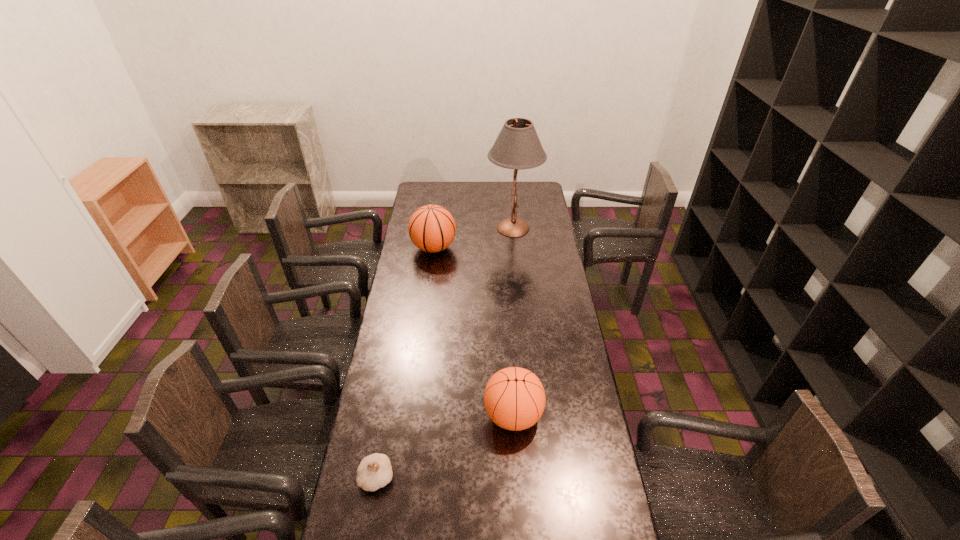
This screenshot has width=960, height=540. Identify the location of table lamp. (518, 147).

This screenshot has height=540, width=960. I want to click on the left basketball, so click(431, 228).

Find the location of `the farther basketball`. the farther basketball is located at coordinates (431, 228).

This screenshot has width=960, height=540. Identify the location of the third farthest object. (514, 398).

The height and width of the screenshot is (540, 960). What are the coordinates of `the shorter basketball` in the screenshot? It's located at (514, 398).

Where is `the shortest object`? This screenshot has width=960, height=540. the shortest object is located at coordinates (375, 471).

Identify the location of garlic. (375, 471).

Find the location of a particular element. The width and height of the screenshot is (960, 540). vacant space located 0.140m on the front-facing side of the table lamp is located at coordinates (460, 228).

Find the location of a particular element. The width and height of the screenshot is (960, 540). vacant space located on the front-facing side of the table lamp is located at coordinates (460, 228).

This screenshot has height=540, width=960. In order to click on vacant space located on the front-facing side of the table lamp in this screenshot , I will do (458, 228).